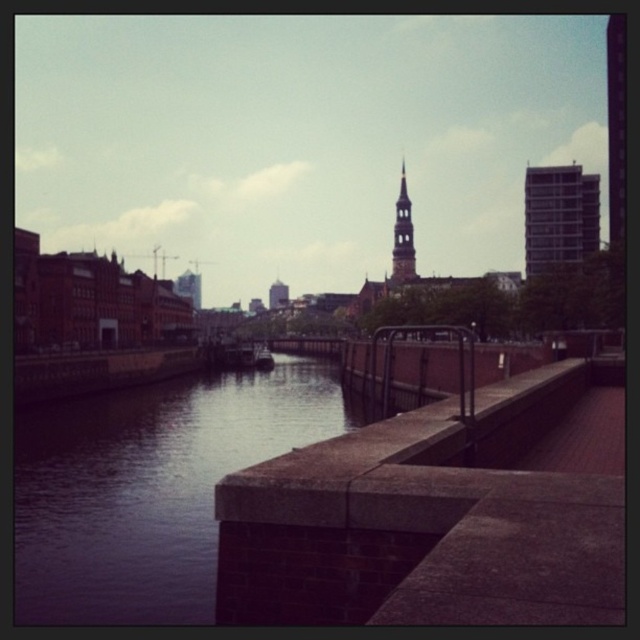
Question: Is dark gray concrete river at center in front of gray concrete building at upper right?

Choices:
 (A) yes
 (B) no

Answer: (A)

Question: Which point is closer to the camera taking this photo?

Choices:
 (A) [528, 225]
 (B) [100, 593]

Answer: (B)

Question: Which of the following is the closest to the observer?

Choices:
 (A) gray concrete building at upper right
 (B) dark gray concrete river at center

Answer: (B)

Question: Is dark gray concrete river at center to the right of gray concrete building at upper right from the viewer's perspective?

Choices:
 (A) no
 (B) yes

Answer: (A)

Question: Does dark gray concrete river at center appear on the right side of gray concrete building at upper right?

Choices:
 (A) yes
 (B) no

Answer: (B)